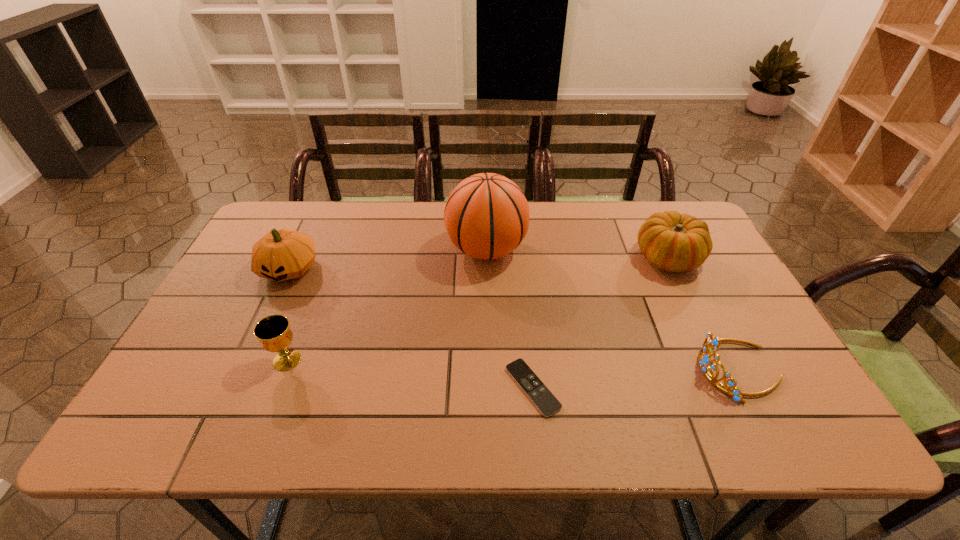
Locate an element on the screen. Image resolution: width=960 pixels, height=540 pixels. vacant space that is in between the right gourd and the chalice is located at coordinates (478, 309).

At what (x,y) coordinates should I click in order to perform the action: click on vacant space that is in between the shortest object and the right gourd. Please return your answer as a coordinate pair (x, y). The height and width of the screenshot is (540, 960). Looking at the image, I should click on (601, 323).

This screenshot has width=960, height=540. What are the coordinates of `empty space between the basketball and the remote control` in the screenshot? It's located at click(x=510, y=319).

This screenshot has width=960, height=540. Find the location of `vacant area that lies between the tiara and the shortest object`. vacant area that lies between the tiara and the shortest object is located at coordinates (636, 379).

Find the location of `free space between the remote control and the basketball`. free space between the remote control and the basketball is located at coordinates (510, 319).

You are a GUI agent. You are given a task and a screenshot of the screen. Output one action in this format:
    pyautogui.click(x=<x>, y=<y>)
    Task: Click on the free space that is in between the shortest object and the tiara
    
    Given the screenshot: What is the action you would take?
    pyautogui.click(x=636, y=379)

Locate an element on the screen. The height and width of the screenshot is (540, 960). object that can be found as the fourth closest to the left gourd is located at coordinates (672, 242).

Choose which object is the third nearest neighbor to the chalice. Please provide its 2D coordinates. Your answer should be formatted as a tuple, i.e. [(x, y)], where the tuple contains the x and y coordinates of a point satisfying the conditions above.

[(539, 394)]

This screenshot has height=540, width=960. Find the location of `vacant area in the image that satisfies the following two spatial constraints: 1. on the side of the remote control with the carved face; 2. on the left side of the left gourd`. vacant area in the image that satisfies the following two spatial constraints: 1. on the side of the remote control with the carved face; 2. on the left side of the left gourd is located at coordinates (233, 388).

The image size is (960, 540). I want to click on free space that satisfies the following two spatial constraints: 1. on the front-facing side of the tiara; 2. on the front side of the remote control, so click(748, 388).